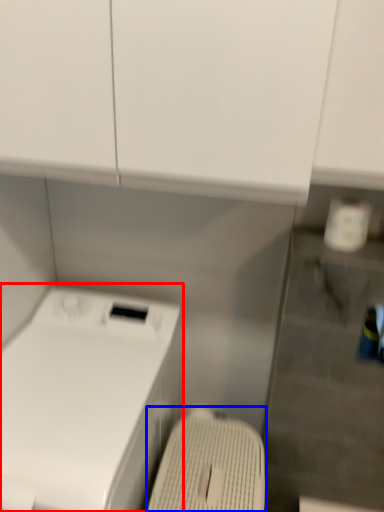
Question: Among these objects, which one is farthest to the camera, home appliance (highlighted by a red box) or washing machine (highlighted by a blue box)?

Choices:
 (A) home appliance
 (B) washing machine

Answer: (B)